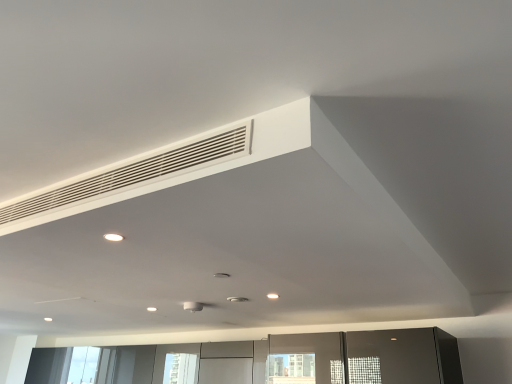
Measure the distance between white matte air conditioning at upper left and camera.

white matte air conditioning at upper left is 3.97 feet from camera.

Describe the element at coordinates (132, 174) in the screenshot. I see `white matte air conditioning at upper left` at that location.

In order to click on white matte air conditioning at upper left in this screenshot , I will do `click(132, 174)`.

Locate an element on the screen. The height and width of the screenshot is (384, 512). white matte air conditioning at upper left is located at coordinates (132, 174).